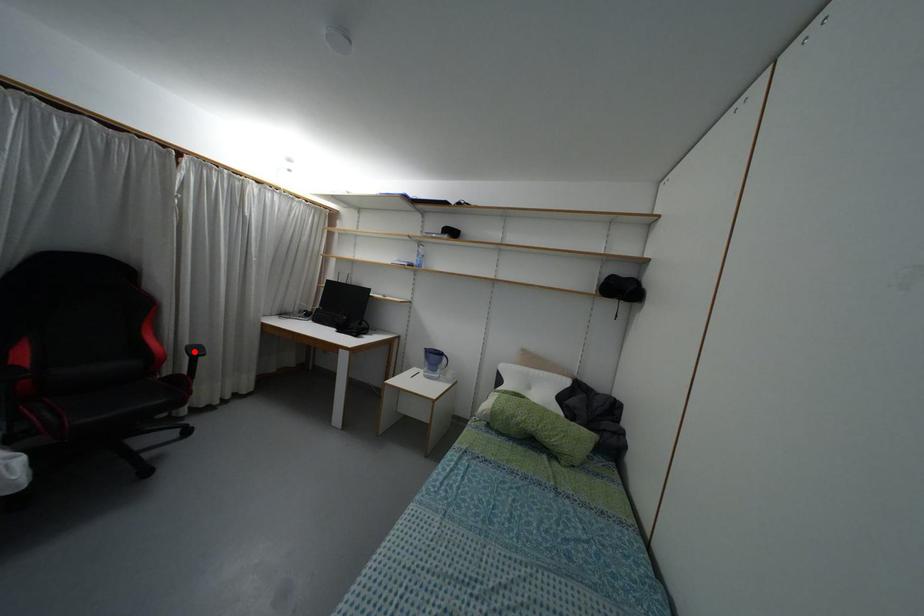
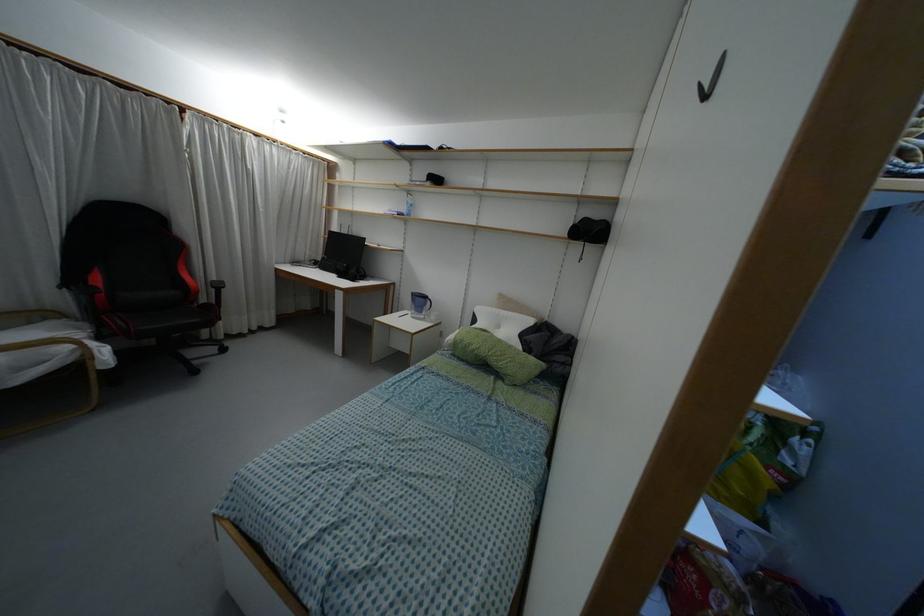
Locate, in the second image, the point that corresponds to the highlighted location in the first image.

(217, 286)